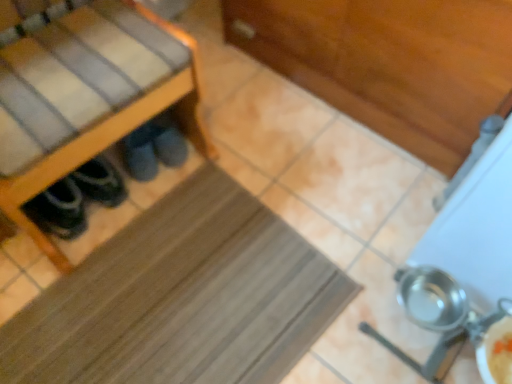
This screenshot has width=512, height=384. I want to click on vacant space that is in between wooden shoe rack at left and metallic silver pot at lower right, so click(x=242, y=266).